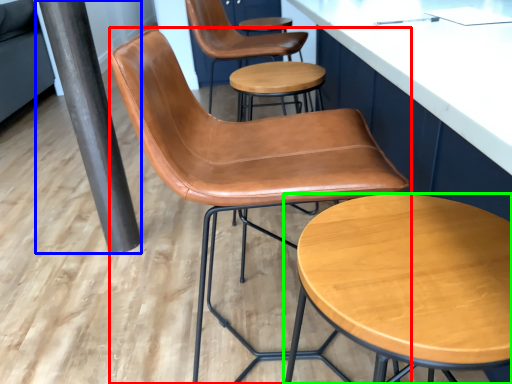
Question: Which object is the farthest from chair (highlighted by a red box)? Choose among these: beam (highlighted by a blue box) or stool (highlighted by a green box).

Choices:
 (A) beam
 (B) stool

Answer: (A)